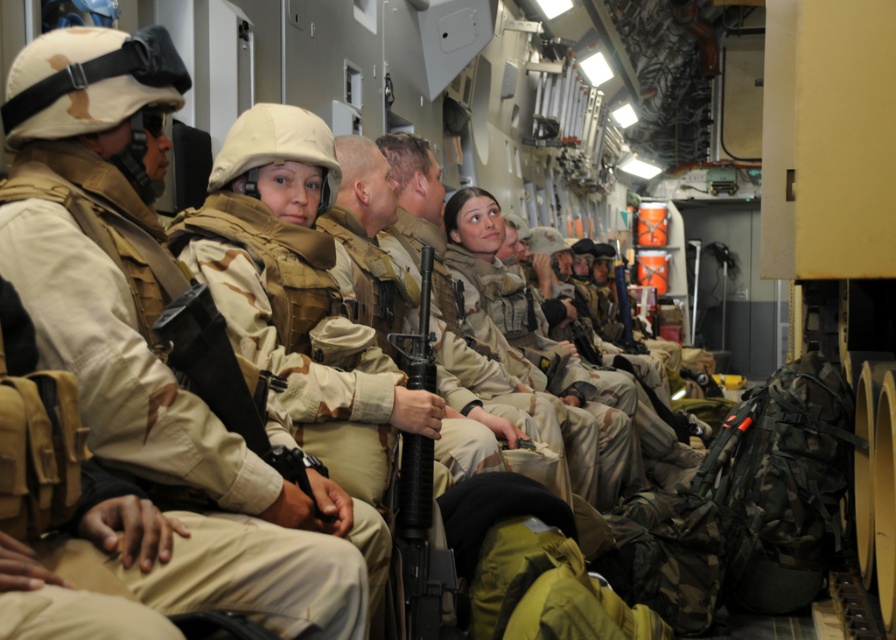
Question: Is camouflage uniform at left smaller than matte black rifle at center?

Choices:
 (A) no
 (B) yes

Answer: (A)

Question: Is camouflage uniform at left to the left of black matte rifle at center from the viewer's perspective?

Choices:
 (A) no
 (B) yes

Answer: (B)

Question: Which point is farther to the camera?

Choices:
 (A) camouflage uniform at left
 (B) black matte rifle at center
 (C) matte black rifle at center

Answer: (B)

Question: Among these points, which one is nearest to the camera?

Choices:
 (A) (218, 394)
 (B) (336, 550)

Answer: (B)

Question: Can you confirm if camouflage uniform at left is smaller than matte black rifle at center?

Choices:
 (A) no
 (B) yes

Answer: (A)

Question: Estimate the real-world distances between objects in this image. Which object is closer to the camouflage uniform at left?

Choices:
 (A) matte black rifle at center
 (B) black matte rifle at center

Answer: (A)